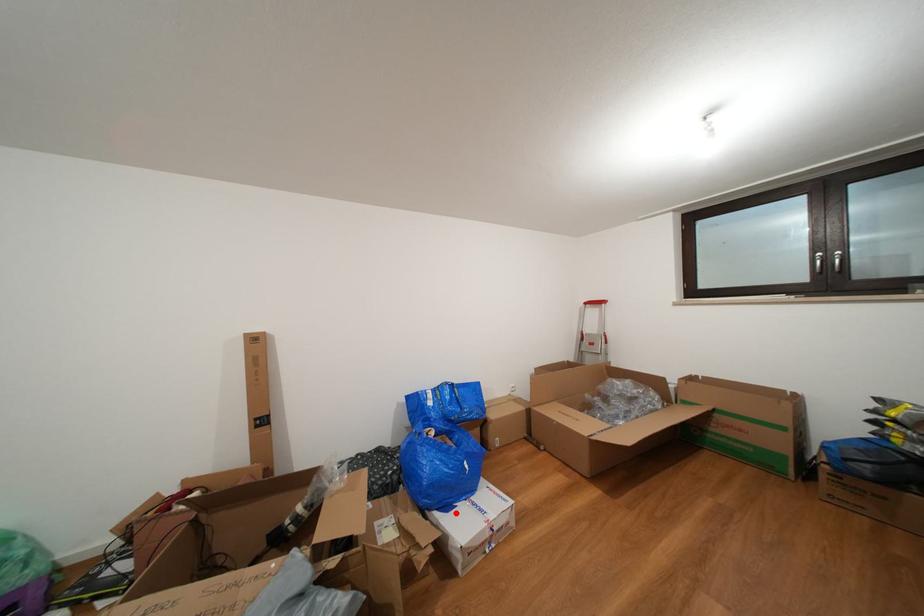
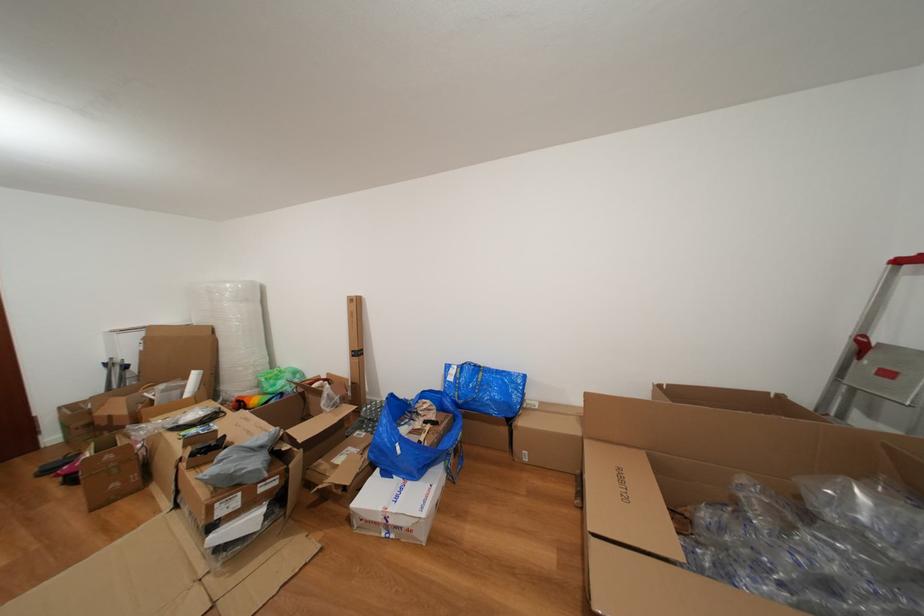
Locate, in the second image, the point that corresponds to the highlighted location in the first image.

(394, 479)